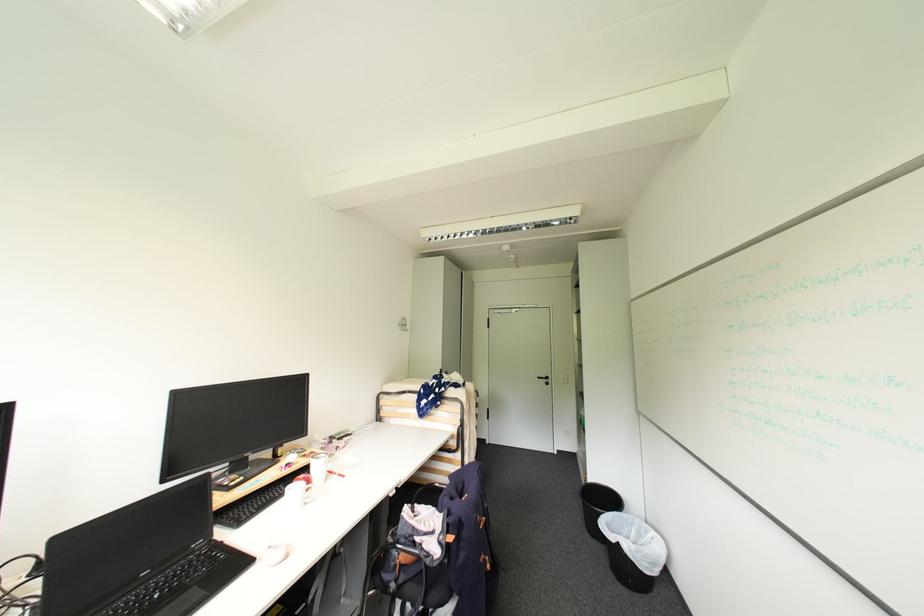
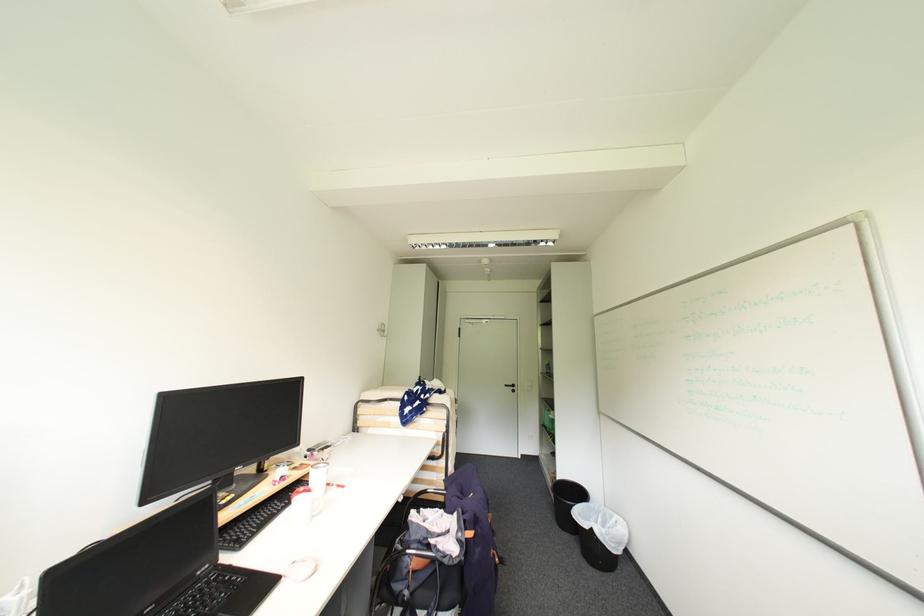
Question: Based on the continuous images, in which direction is the camera rotating? Reply with the corresponding letter.

Choices:
 (A) Left
 (B) Right
 (C) Up
 (D) Down

Answer: (B)